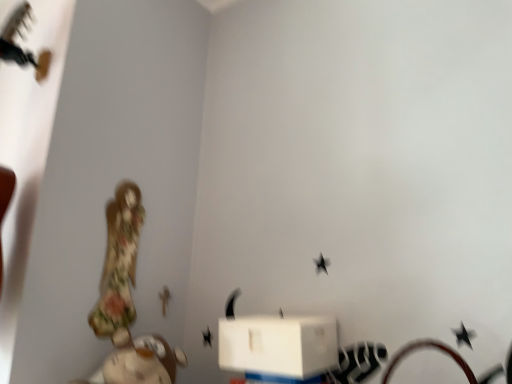
What are the coordinates of `white matte box at lower center` in the screenshot? It's located at (279, 346).

The image size is (512, 384). Describe the element at coordinates (279, 346) in the screenshot. I see `white matte box at lower center` at that location.

Where is `white matte box at lower center`? white matte box at lower center is located at coordinates (279, 346).